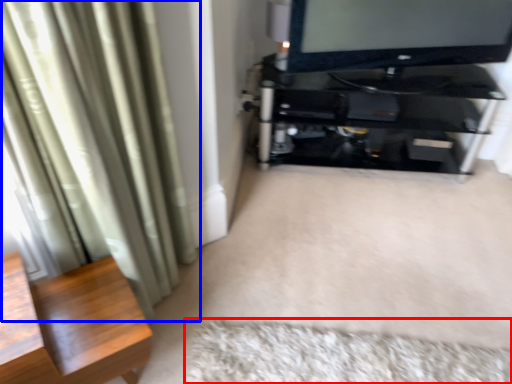
Question: Among these objects, which one is farthest to the camera, mat (highlighted by a red box) or curtain (highlighted by a blue box)?

Choices:
 (A) mat
 (B) curtain

Answer: (A)